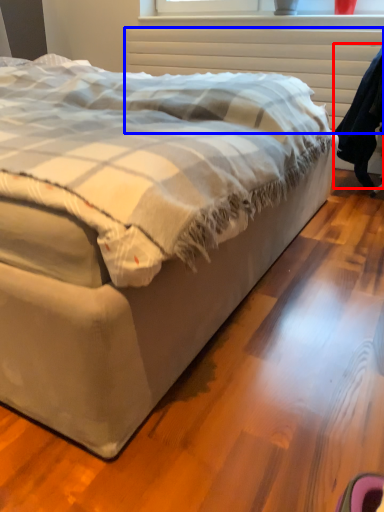
Question: Which object is closer to the camera taking this photo, robe (highlighted by a red box) or radiator (highlighted by a blue box)?

Choices:
 (A) robe
 (B) radiator

Answer: (A)